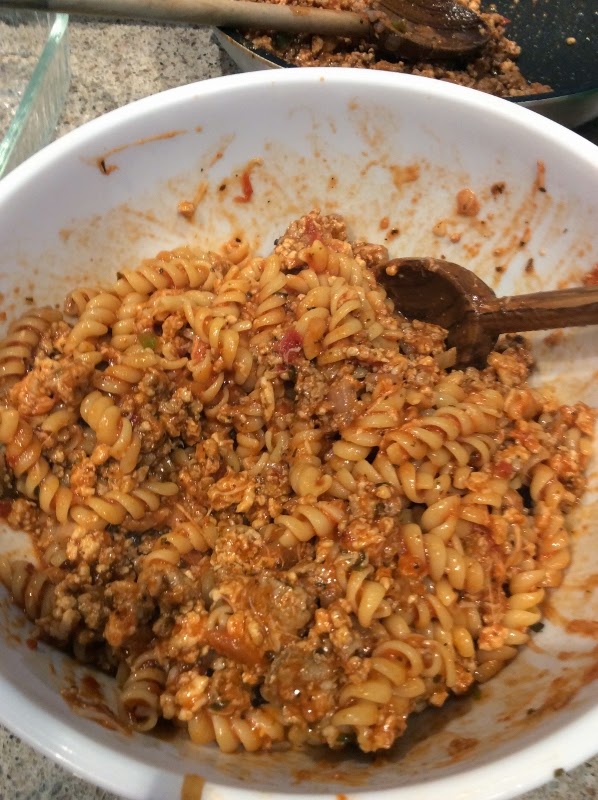
This screenshot has width=598, height=800. Identify the location of handle. (585, 301), (259, 18).